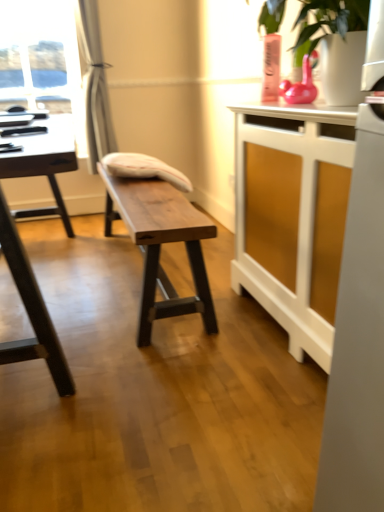
Question: Is white wood cabinet at right, the 1th table positioned from the right, shorter than black glossy table at left, the 1th table from the left?

Choices:
 (A) yes
 (B) no

Answer: (B)

Question: Considering the relative sizes of white wood cabinet at right, the 1th table positioned from the right, and black glossy table at left, the 3th table from the right, in the image provided, is white wood cabinet at right, the 1th table positioned from the right, taller than black glossy table at left, the 3th table from the right,?

Choices:
 (A) no
 (B) yes

Answer: (B)

Question: From a real-world perspective, is white wood cabinet at right, the 1th table positioned from the right, physically above black glossy table at left, the 3th table from the right?

Choices:
 (A) yes
 (B) no

Answer: (A)

Question: Is white wood cabinet at right, the 3th table from the left, not close to black glossy table at left, the 1th table from the left?

Choices:
 (A) yes
 (B) no

Answer: (B)

Question: Is white wood cabinet at right, the 3th table from the left, not within black glossy table at left, the 3th table from the right?

Choices:
 (A) no
 (B) yes

Answer: (B)

Question: From the image's perspective, is silky white curtain at left located above or below white wood cabinet at right, the 3th table from the left?

Choices:
 (A) below
 (B) above

Answer: (B)

Question: Looking at their shapes, would you say silky white curtain at left is wider or thinner than white wood cabinet at right, the 1th table positioned from the right?

Choices:
 (A) wide
 (B) thin

Answer: (B)

Question: Is silky white curtain at left in front of or behind white wood cabinet at right, the 1th table positioned from the right, in the image?

Choices:
 (A) behind
 (B) front

Answer: (A)

Question: In terms of height, does silky white curtain at left look taller or shorter compared to white wood cabinet at right, the 3th table from the left?

Choices:
 (A) tall
 (B) short

Answer: (A)

Question: Considering the positions of silky white curtain at left and black glossy table at left, the 1th table from the left, in the image, is silky white curtain at left wider or thinner than black glossy table at left, the 1th table from the left,?

Choices:
 (A) thin
 (B) wide

Answer: (A)

Question: From a real-world perspective, relative to black glossy table at left, the 3th table from the right, is silky white curtain at left vertically above or below?

Choices:
 (A) below
 (B) above

Answer: (B)

Question: Based on their positions, is silky white curtain at left located to the left or right of black glossy table at left, the 1th table from the left?

Choices:
 (A) left
 (B) right

Answer: (B)

Question: Is silky white curtain at left spatially inside black glossy table at left, the 3th table from the right, or outside of it?

Choices:
 (A) inside
 (B) outside

Answer: (B)

Question: Looking at the image, does white wood cabinet at right, the 1th table positioned from the right, seem bigger or smaller compared to silky white curtain at left?

Choices:
 (A) small
 (B) big

Answer: (B)

Question: In terms of width, does white wood cabinet at right, the 3th table from the left, look wider or thinner when compared to silky white curtain at left?

Choices:
 (A) thin
 (B) wide

Answer: (B)